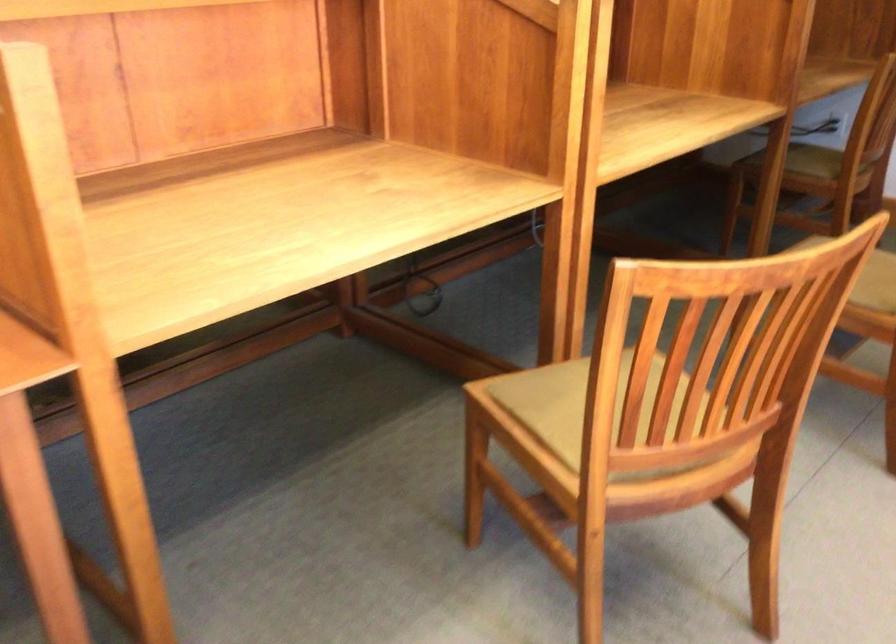
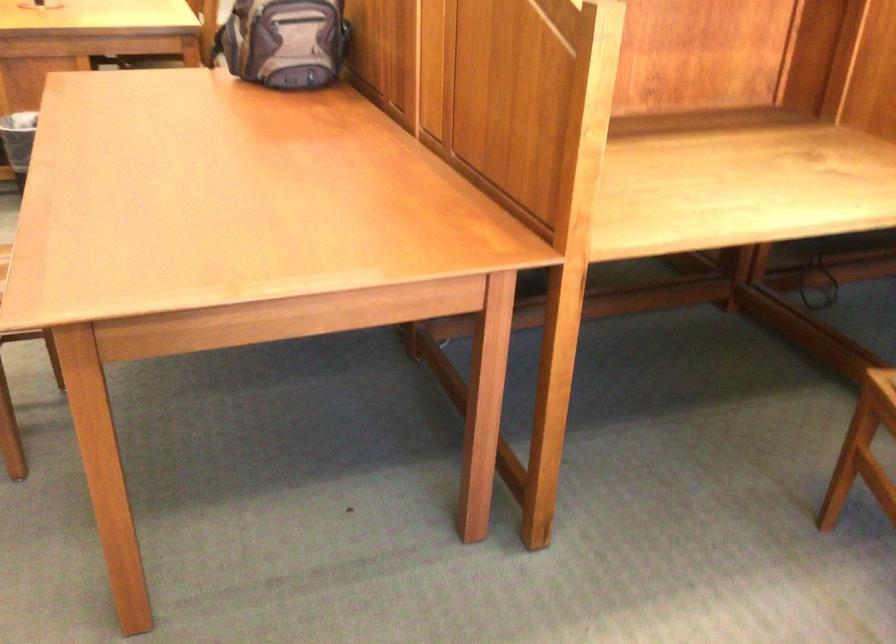
Question: Based on the continuous images, in which direction is the camera rotating? Reply with the corresponding letter.

Choices:
 (A) Left
 (B) Right
 (C) Up
 (D) Down

Answer: (A)